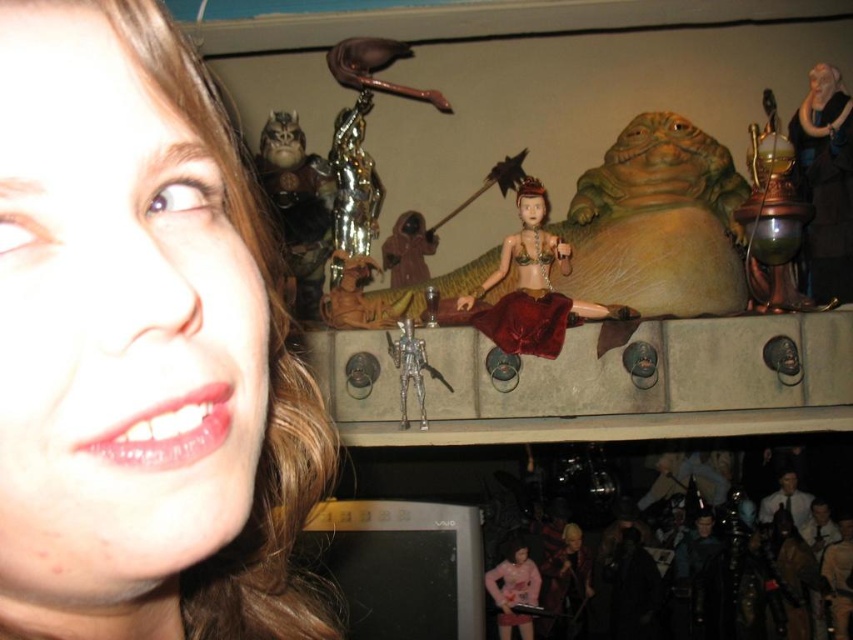
Question: Which object is positioned closest to the smooth beige statue at upper right?

Choices:
 (A) pink fabric doll at lower center
 (B) matte skin at left
 (C) shiny red fabric at center

Answer: (C)

Question: Which of the following is the closest to the observer?

Choices:
 (A) pink fabric doll at lower center
 (B) matte skin at left
 (C) smooth beige statue at upper right
 (D) shiny red fabric at center

Answer: (B)

Question: Observing the image, what is the correct spatial positioning of matte skin at left in reference to smooth beige statue at upper right?

Choices:
 (A) above
 (B) below

Answer: (B)

Question: In this image, where is matte skin at left located relative to smooth beige statue at upper right?

Choices:
 (A) above
 (B) below

Answer: (B)

Question: Which object is positioned farthest from the smooth beige statue at upper right?

Choices:
 (A) matte skin at left
 (B) shiny red fabric at center
 (C) pink fabric doll at lower center

Answer: (A)

Question: Is matte skin at left positioned behind smooth beige statue at upper right?

Choices:
 (A) no
 (B) yes

Answer: (A)